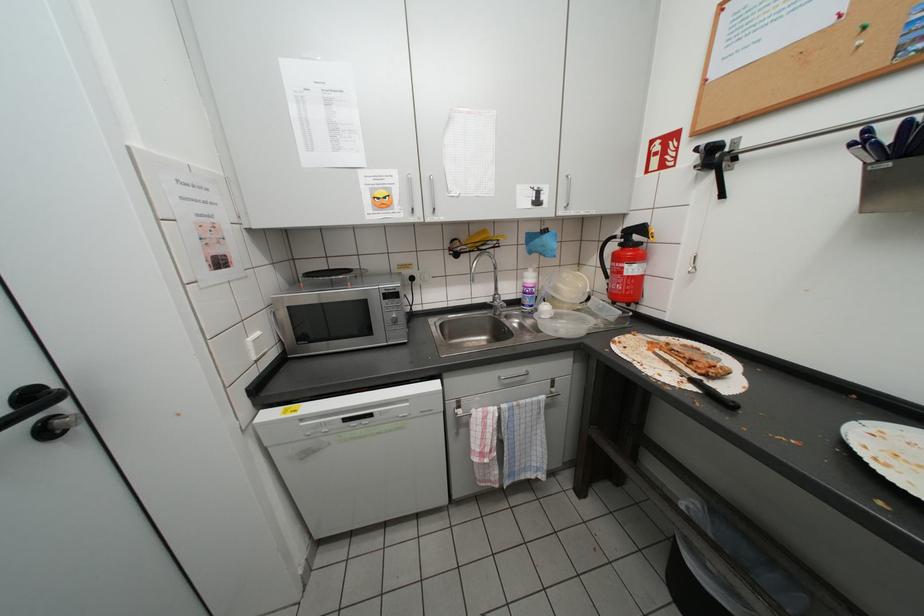
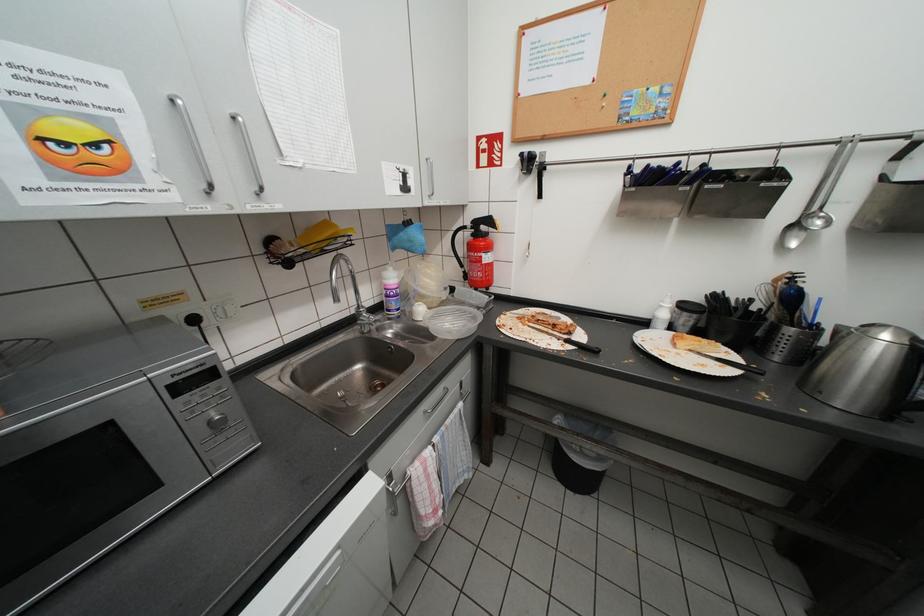
Question: The images are taken continuously from a first-person perspective. In which direction is your viewpoint rotating?

Choices:
 (A) Left
 (B) Right
 (C) Up
 (D) Down

Answer: (B)